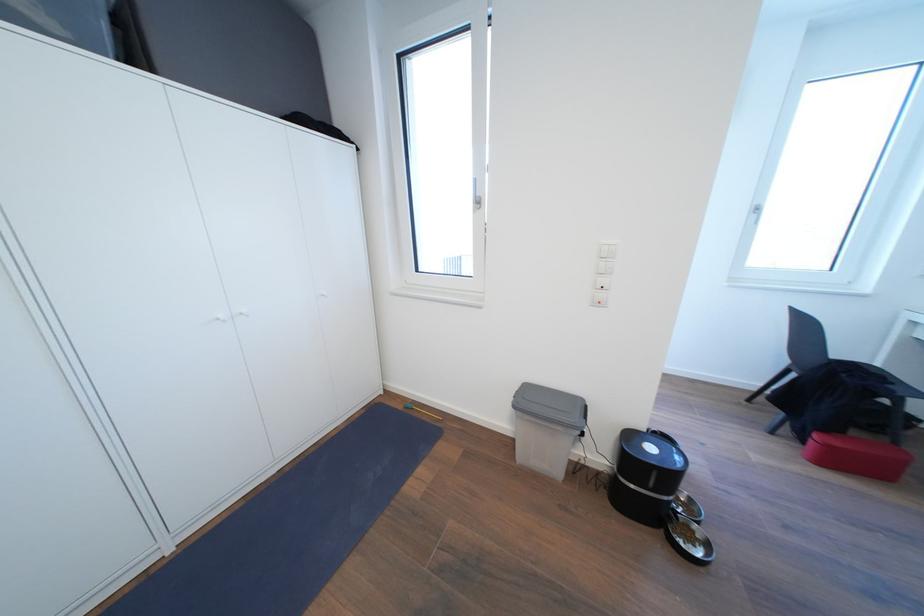
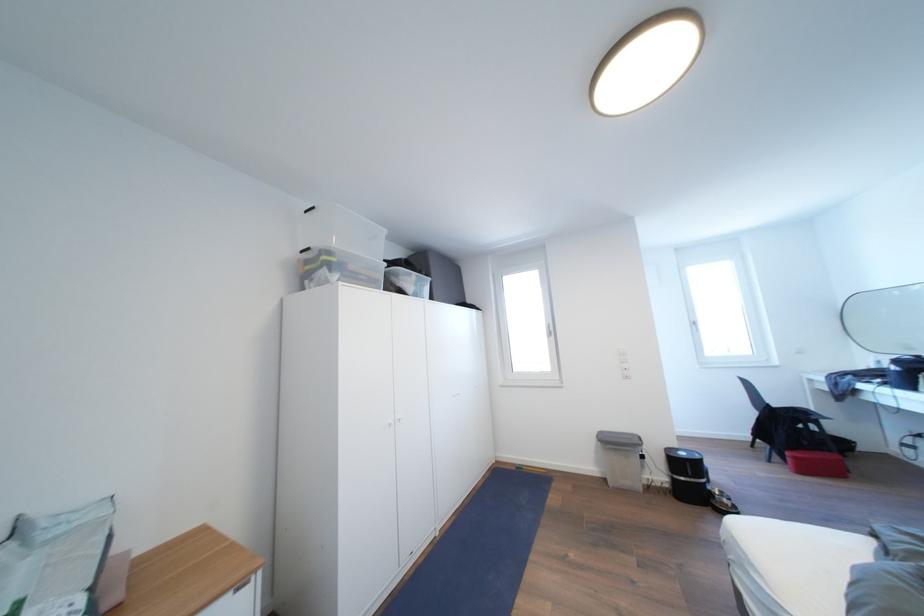
The point at [659,453] is marked in the first image. Where is the corresponding point in the second image?

(689, 459)